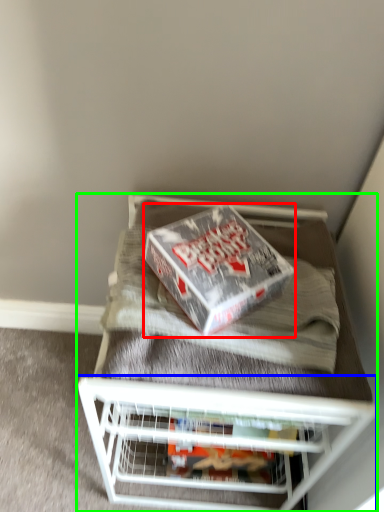
Question: Which object is positioned farthest from box (highlighted by a red box)? Select from shelf (highlighted by a blue box) and furniture (highlighted by a green box).

Choices:
 (A) shelf
 (B) furniture

Answer: (A)